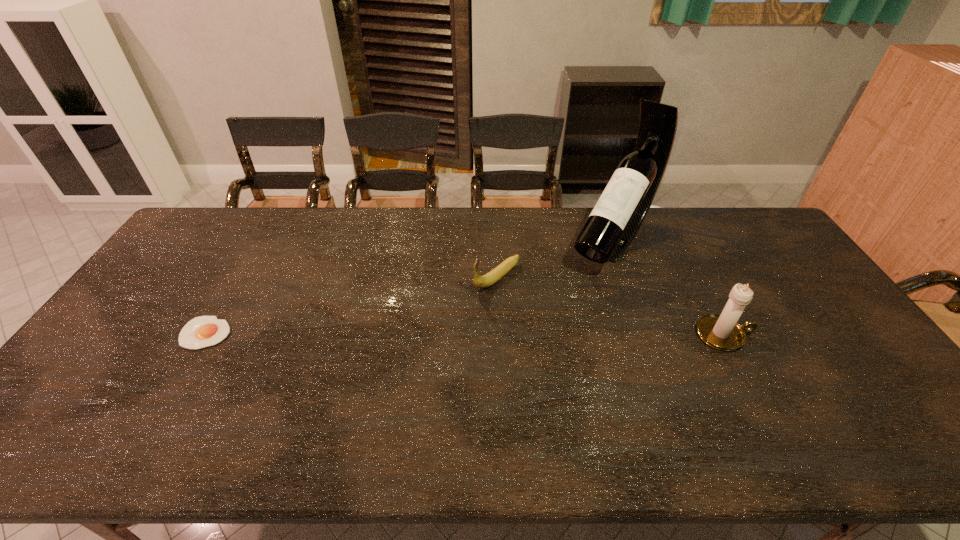
At what (x,y) coordinates should I click in order to perform the action: click on free space on the desktop that is between the egg yolk and the second tallest object and is positioned at the stem of the second object from left to right. Please return your answer as a coordinate pair (x, y). Image resolution: width=960 pixels, height=540 pixels. Looking at the image, I should click on (420, 334).

This screenshot has height=540, width=960. Find the location of `vacant space on the desktop that is between the leftmost object and the second tallest object and is positioned on the stand of the tallest object`. vacant space on the desktop that is between the leftmost object and the second tallest object and is positioned on the stand of the tallest object is located at coordinates (535, 334).